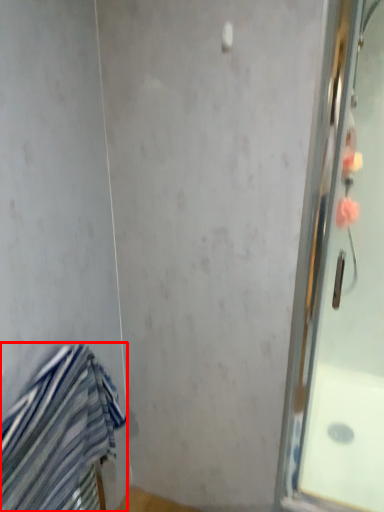
Question: From the image's perspective, what is the correct spatial relationship of towel (annotated by the red box) in relation to screen door?

Choices:
 (A) above
 (B) below

Answer: (B)